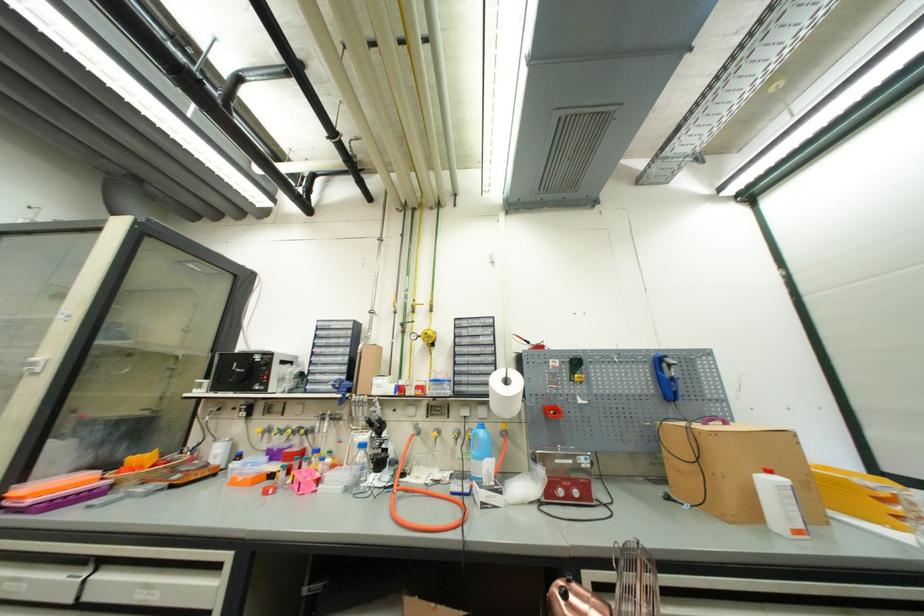
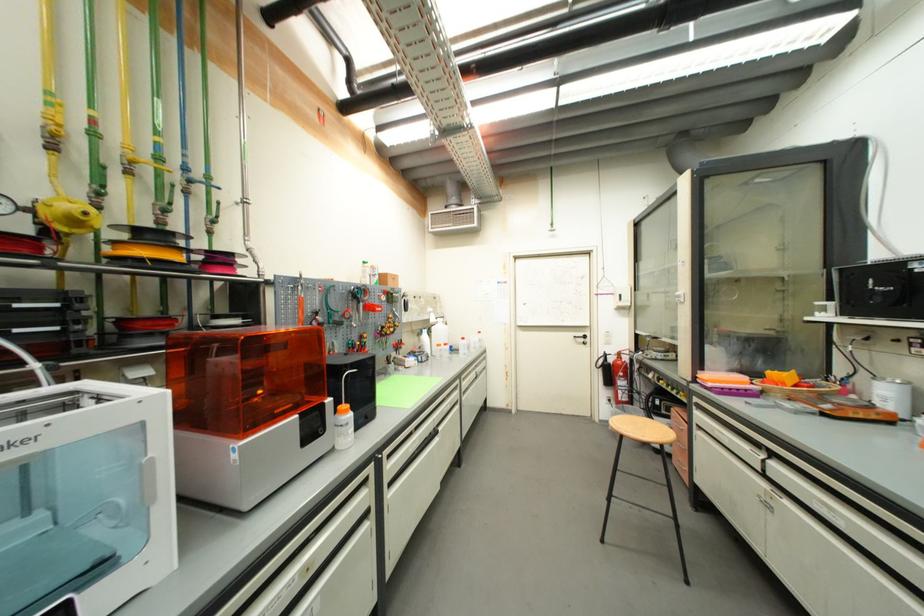
In the second image, find the point that corresponds to point 86,578 in the first image.

(764, 456)